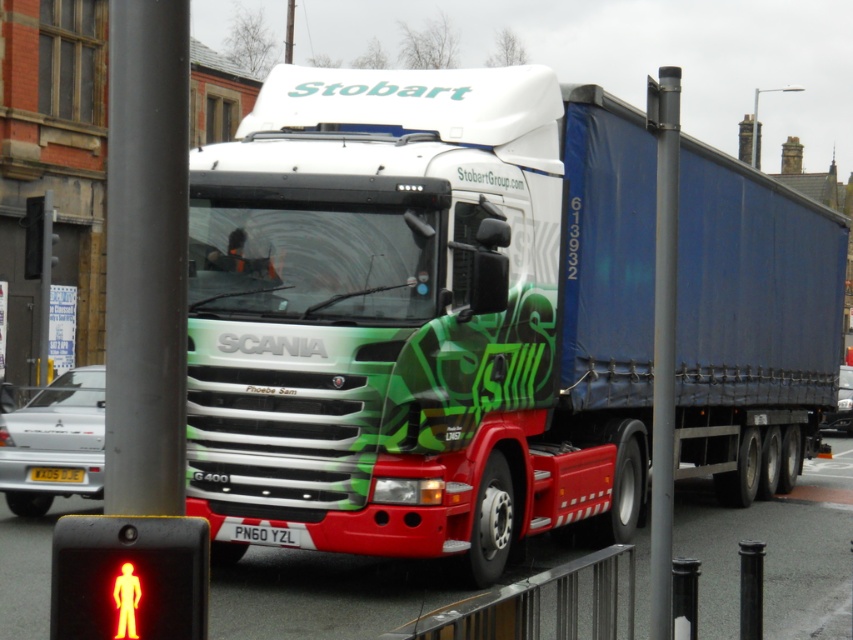
Is green matte truck at center to the left of yellow plastic pedestrian at lower left from the viewer's perspective?

No, green matte truck at center is not to the left of yellow plastic pedestrian at lower left.

Is green matte truck at center closer to camera compared to yellow plastic pedestrian at lower left?

No, it is not.

Which is in front, point (260, 506) or point (151, 625)?

Point (151, 625) is in front.

What are the coordinates of `green matte truck at center` in the screenshot? It's located at (421, 314).

Which is below, green matte truck at center or yellow matte license plate at center?

yellow matte license plate at center is lower down.

Looking at this image, is green matte truck at center above yellow matte license plate at center?

Yes.

What do you see at coordinates (421, 314) in the screenshot?
I see `green matte truck at center` at bounding box center [421, 314].

You are a GUI agent. You are given a task and a screenshot of the screen. Output one action in this format:
    pyautogui.click(x=<x>, y=<y>)
    Task: Click on the green matte truck at center
    
    Given the screenshot: What is the action you would take?
    pyautogui.click(x=421, y=314)

Which is below, yellow plastic pedestrian at lower left or yellow matte license plate at center?

yellow matte license plate at center is lower down.

Is point (119, 604) in front of point (33, 472)?

Yes, point (119, 604) is closer to viewer.

Who is more distant from viewer, (x=51, y=541) or (x=68, y=481)?

Positioned behind is point (x=68, y=481).

This screenshot has height=640, width=853. In order to click on yellow plastic pedestrian at lower left in this screenshot , I will do `click(128, 577)`.